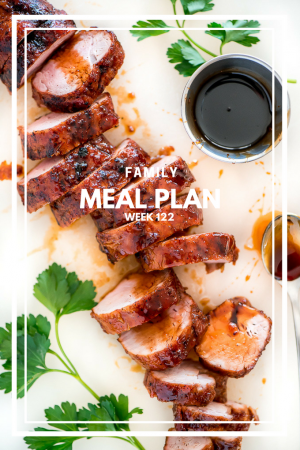
The image size is (300, 450). In order to click on white frame in this screenshot , I will do `click(184, 433)`, `click(172, 421)`.